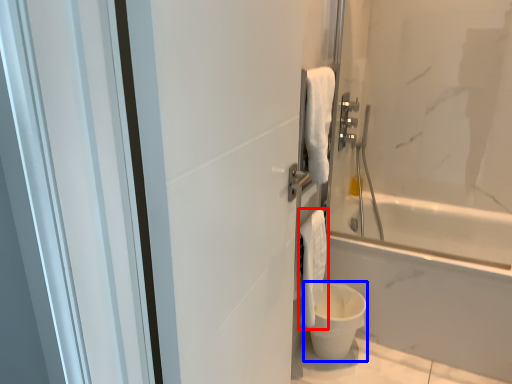
Question: Which object is closer to the camera taking this photo, bath towel (highlighted by a red box) or toilet bowl (highlighted by a blue box)?

Choices:
 (A) bath towel
 (B) toilet bowl

Answer: (A)